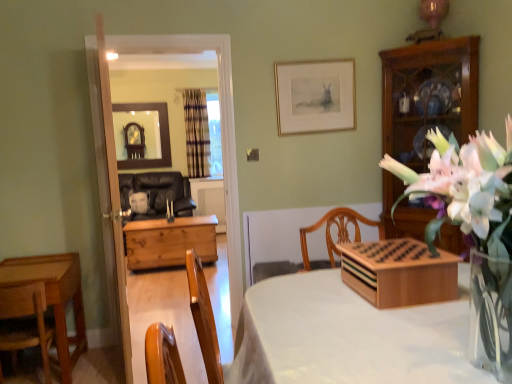
Question: From a real-world perspective, is matte gold picture frame at upper center above or below wooden door at left?

Choices:
 (A) below
 (B) above

Answer: (B)

Question: Would you say matte gold picture frame at upper center is inside or outside wooden door at left?

Choices:
 (A) outside
 (B) inside

Answer: (A)

Question: Considering the real-world distances, which object is closest to the plaid fabric curtain at center?

Choices:
 (A) wooden chair at lower left, the first chair positioned from the front
 (B) wooden game board at center
 (C) transparent glass door at upper center
 (D) wooden chest at center
 (E) white glossy vase at center right

Answer: (D)

Question: Which object is the closest to the wooden game board at center?

Choices:
 (A) matte gold picture frame at upper center
 (B) wooden chair at lower left, the first chair positioned from the front
 (C) wooden door at left
 (D) plaid fabric curtain at center
 (E) white glossy vase at center right

Answer: (E)